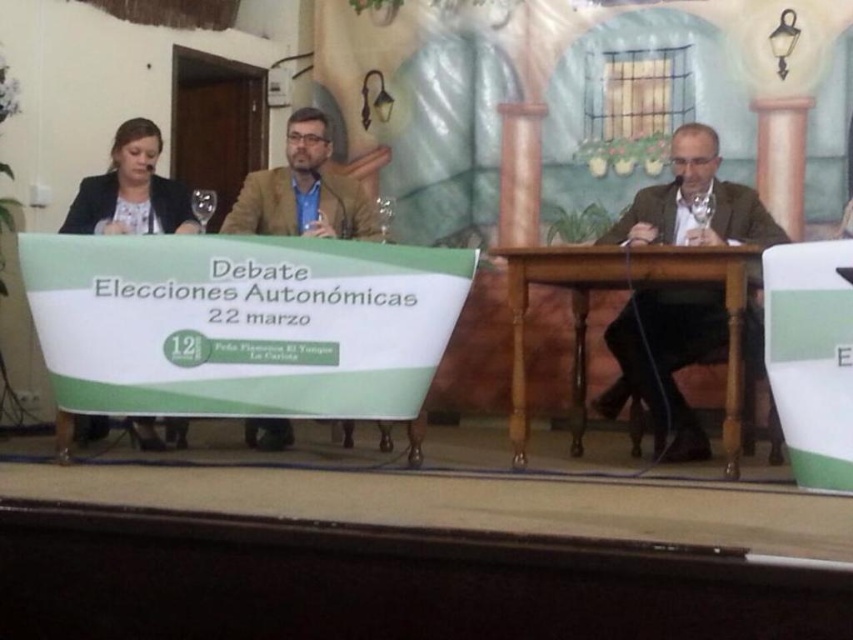
Question: Where is brown textured suit at center located in relation to matte black jacket at left in the image?

Choices:
 (A) above
 (B) below

Answer: (B)

Question: Among these objects, which one is farthest from the camera?

Choices:
 (A) matte black jacket at left
 (B) matte brown blazer at center
 (C) brown wooden table at center

Answer: (B)

Question: Does brown wooden table at center come in front of matte black jacket at left?

Choices:
 (A) no
 (B) yes

Answer: (B)

Question: Estimate the real-world distances between objects in this image. Which object is closer to the matte brown blazer at center?

Choices:
 (A) brown textured suit at center
 (B) brown wooden table at center
 (C) matte black jacket at left

Answer: (C)

Question: Does brown wooden table at center have a greater width compared to matte black jacket at left?

Choices:
 (A) yes
 (B) no

Answer: (A)

Question: Which is nearer to the brown wooden table at center?

Choices:
 (A) matte black jacket at left
 (B) matte brown blazer at center
 (C) brown textured suit at center

Answer: (C)